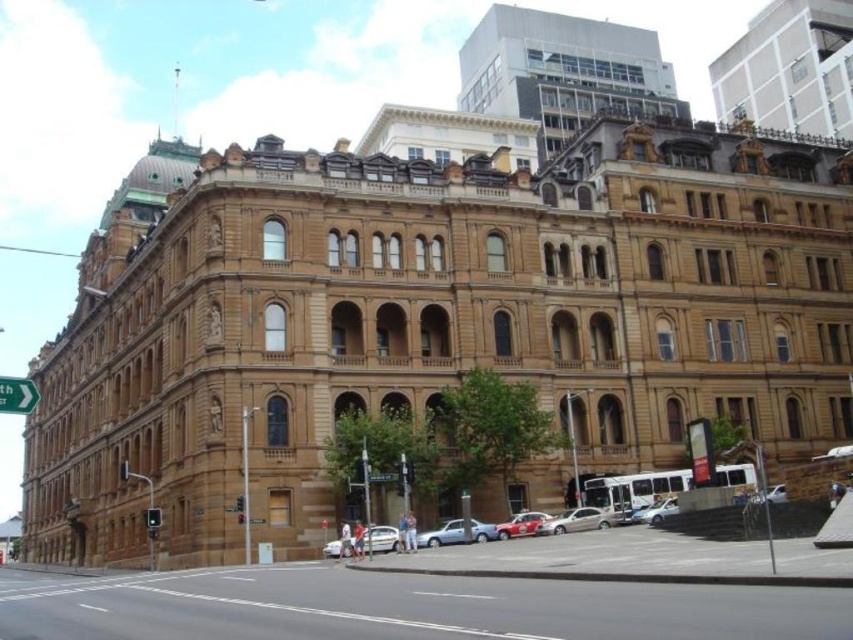
Which of these two, silver metallic sedan at lower center or green plastic street sign at center, stands taller?

silver metallic sedan at lower center is taller.

Is silver metallic sedan at lower center below green plastic street sign at center?

Yes, silver metallic sedan at lower center is below green plastic street sign at center.

Who is more forward, (486, 529) or (376, 474)?

Positioned in front is point (376, 474).

What are the coordinates of `silver metallic sedan at lower center` in the screenshot? It's located at (442, 534).

Between white matte car at lower center and red glossy car at lower center, which one has less height?

Standing shorter between the two is white matte car at lower center.

Between point (386, 529) and point (508, 536), which one is positioned behind?

The point (508, 536) is behind.

Image resolution: width=853 pixels, height=640 pixels. What do you see at coordinates (381, 538) in the screenshot?
I see `white matte car at lower center` at bounding box center [381, 538].

Identify the location of white matte car at lower center. The width and height of the screenshot is (853, 640). (381, 538).

Is green plastic street sign at center smaller than metallic at left?

No.

This screenshot has width=853, height=640. Identify the location of green plastic street sign at center. (383, 476).

In order to click on green plastic street sign at center in this screenshot , I will do `click(383, 476)`.